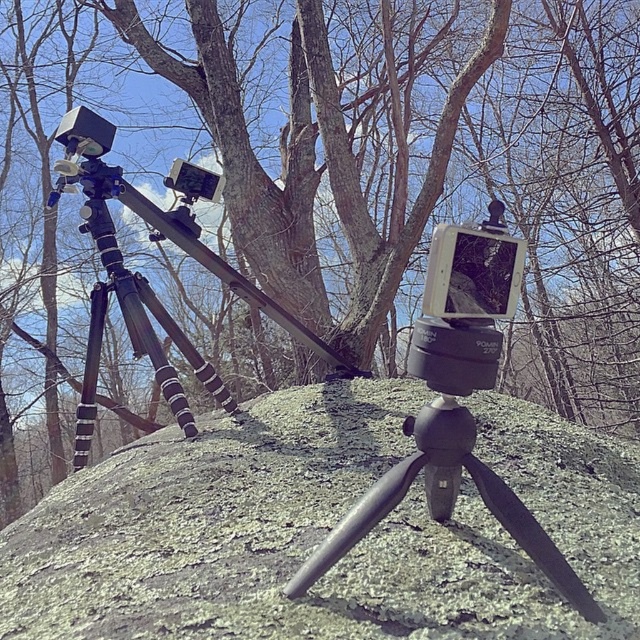
Can you confirm if green mossy rock at center is wider than matte black tripod-mounted camera at center?

Correct, the width of green mossy rock at center exceeds that of matte black tripod-mounted camera at center.

This screenshot has width=640, height=640. Identify the location of green mossy rock at center. (323, 531).